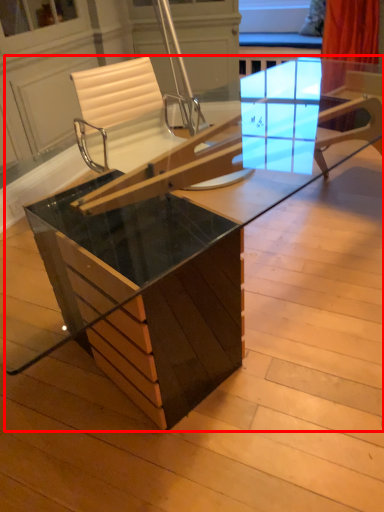
Question: Observing the image, what is the correct spatial positioning of table (annotated by the red box) in reference to chair?

Choices:
 (A) right
 (B) left

Answer: (A)